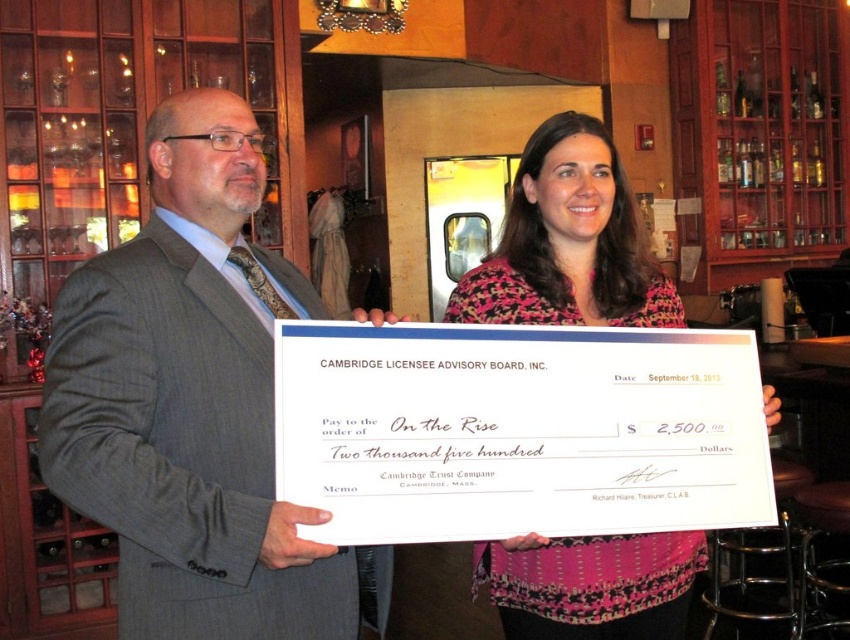
You are a photographer who needs to frame both the gray pinstripe suit at center and the pink floral blouse at center in a single shot. Since you want to highlight the larger item, which one should you focus on to ensure it stands out more?

The gray pinstripe suit at center is bigger than the pink floral blouse at center, so focusing on the gray pinstripe suit at center will make it stand out more in the photo.

You are a photographer positioned in front of the scene. You want to focus your camera on the point closer to you between the two points labeled as point [347,630] and point [556,216]. Which point should you choose?

You should focus on point [347,630] because it is closer to the viewer than point [556,216].

You are a photographer at the event and need to position your camera so that both the gray pinstripe suit at center and the pink floral blouse at center are in frame. Based on their positions, which side of the camera should you aim towards?

Since the gray pinstripe suit at center is to the left of the pink floral blouse at center, you should aim the camera towards the right side to ensure both are in frame.